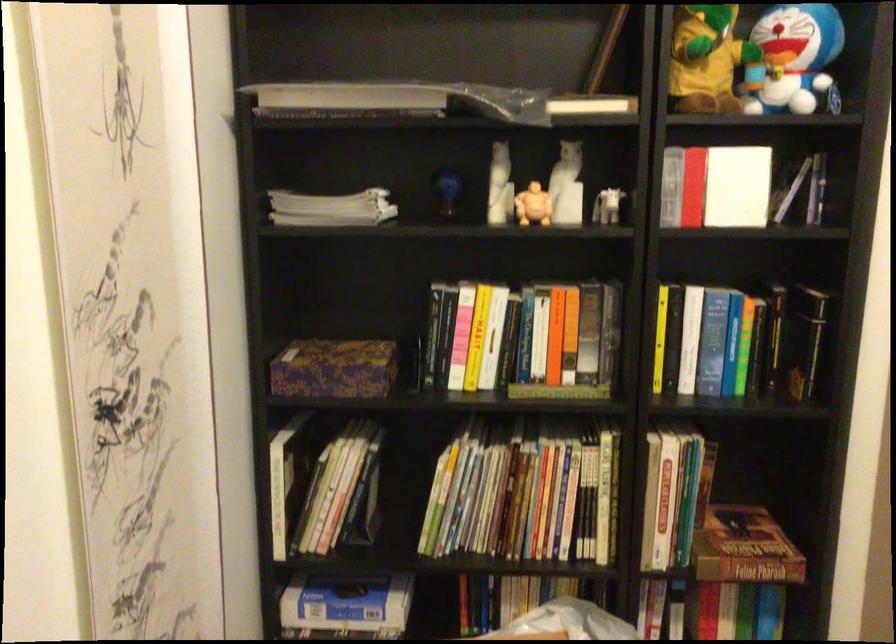
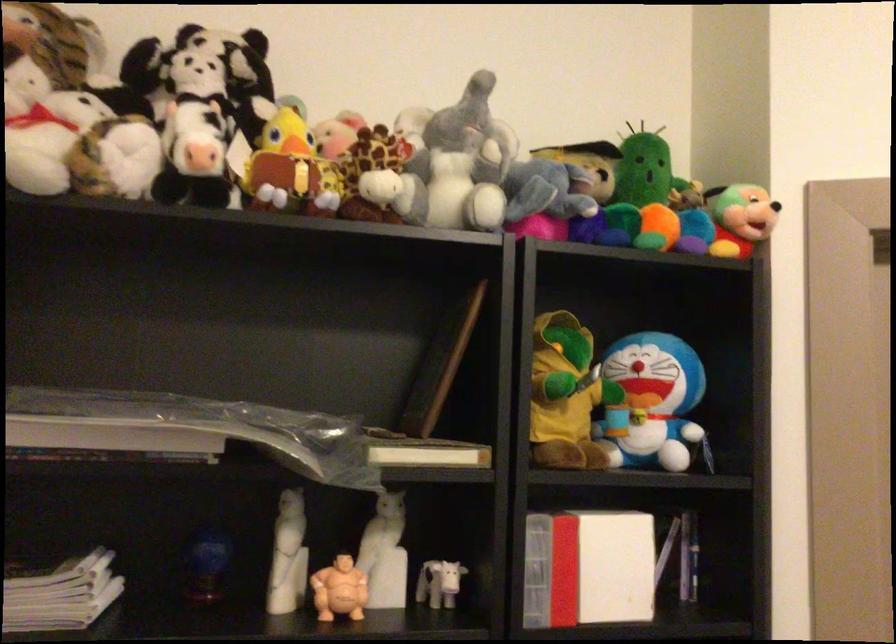
Find the pixel in the second image that matches [497,185] in the first image.

(288, 556)